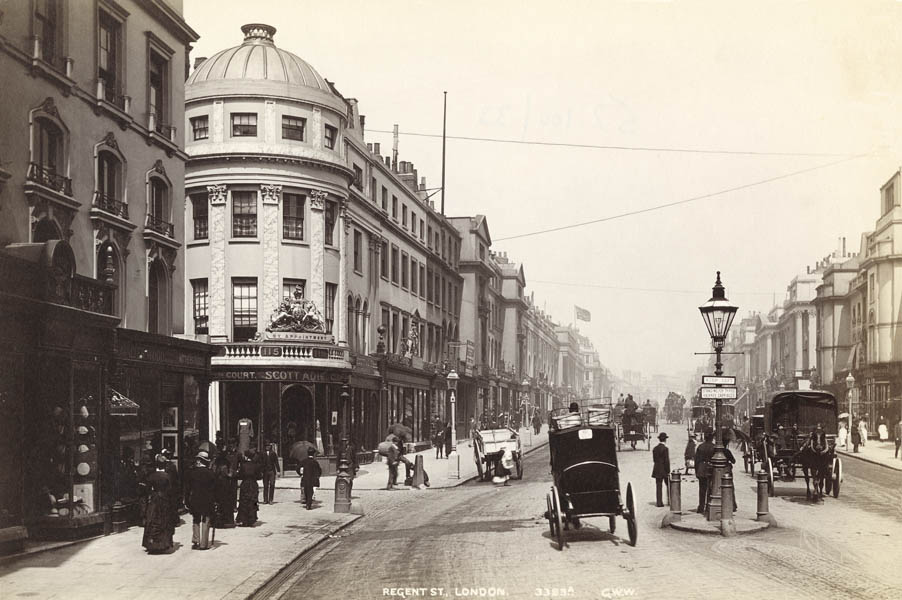
Image resolution: width=902 pixels, height=600 pixels. I want to click on wires, so click(x=606, y=148), click(x=628, y=213).